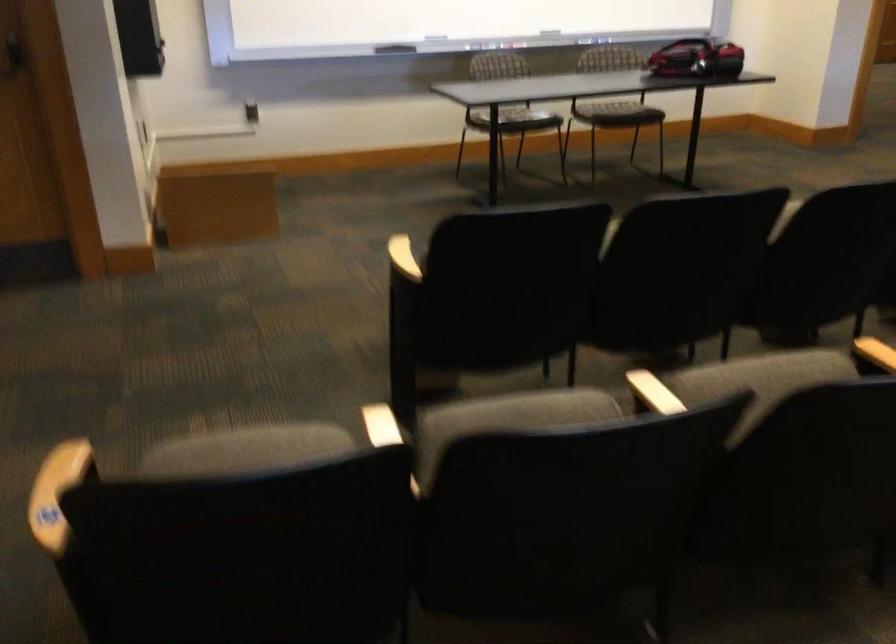
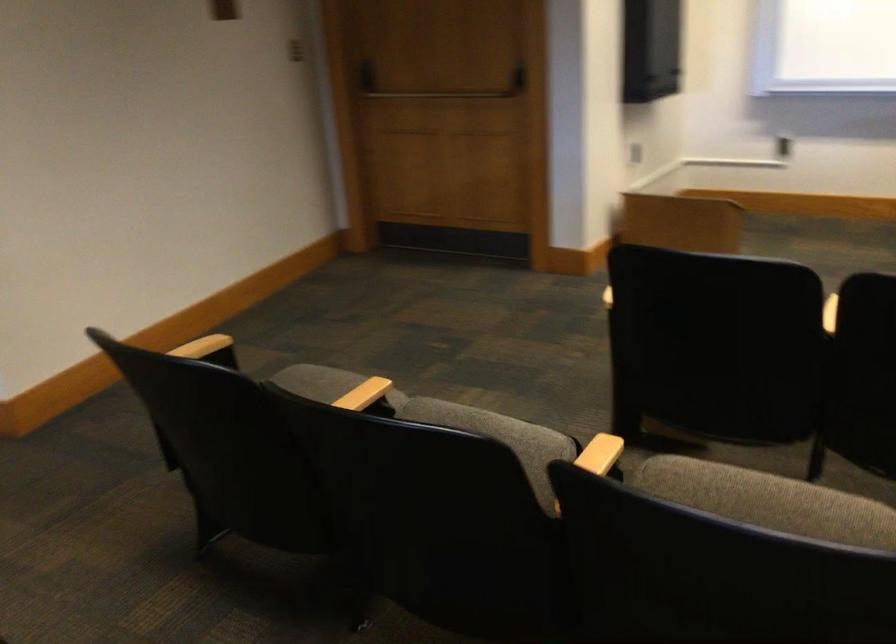
Where in the second image is the point corresponding to (371,438) from the first image?

(350, 397)